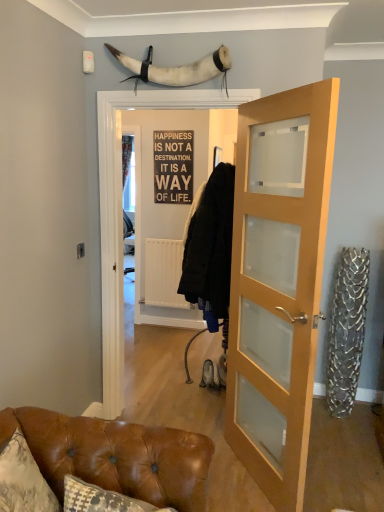
The image size is (384, 512). Find the location of `vacant space to the right of light wood/glass door at center`. vacant space to the right of light wood/glass door at center is located at coordinates (339, 475).